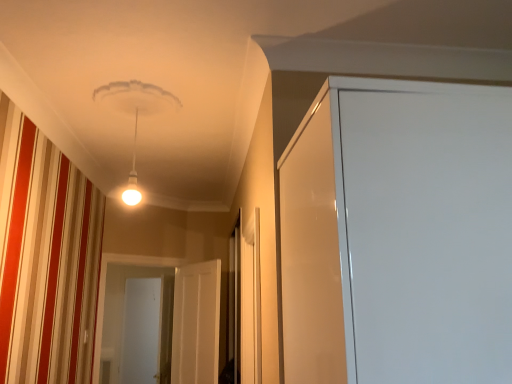
Question: Is white glossy door at center, placed as the 2th screen door when sorted from back to front, oriented towards white glossy door at center, which ranks as the 1th screen door in front-to-back order?

Choices:
 (A) no
 (B) yes

Answer: (B)

Question: Does white glossy door at center, acting as the second screen door starting from the left, contain white glossy door at center, arranged as the 3th screen door when viewed from the left?

Choices:
 (A) yes
 (B) no

Answer: (B)

Question: From the image's perspective, is white glossy door at center, which is the 2th screen door in front-to-back order, on white glossy door at center, arranged as the 3th screen door when viewed from the left?

Choices:
 (A) yes
 (B) no

Answer: (A)

Question: Is white glossy door at center, which is the 2th screen door in front-to-back order, to the right of white glossy door at center, arranged as the 3th screen door when viewed from the left, from the viewer's perspective?

Choices:
 (A) no
 (B) yes

Answer: (A)

Question: Is white glossy door at center, the 2th screen door in the right-to-left sequence, shorter than white glossy door at center, arranged as the 3th screen door when viewed from the back?

Choices:
 (A) yes
 (B) no

Answer: (B)

Question: Is white glossy door at center, placed as the 2th screen door when sorted from back to front, wider or thinner than white glossy screen door at center, arranged as the third screen door when viewed from the front?

Choices:
 (A) wide
 (B) thin

Answer: (A)

Question: Is white glossy door at center, the 2th screen door in the right-to-left sequence, bigger or smaller than white glossy screen door at center, arranged as the third screen door when viewed from the front?

Choices:
 (A) big
 (B) small

Answer: (A)

Question: From the image's perspective, relative to white glossy screen door at center, arranged as the third screen door when viewed from the front, is white glossy door at center, placed as the 2th screen door when sorted from back to front, above or below?

Choices:
 (A) above
 (B) below

Answer: (A)

Question: Is white glossy door at center, acting as the second screen door starting from the left, to the left or to the right of white glossy screen door at center, which appears as the 1th screen door when viewed from the back, in the image?

Choices:
 (A) left
 (B) right

Answer: (B)

Question: In terms of width, does white glossy screen door at center, arranged as the third screen door when viewed from the front, look wider or thinner when compared to white glossy door at center, which is the 2th screen door in front-to-back order?

Choices:
 (A) wide
 (B) thin

Answer: (B)

Question: From a real-world perspective, is white glossy screen door at center, which is counted as the first screen door, starting from the left, above or below white glossy door at center, the 2th screen door in the right-to-left sequence?

Choices:
 (A) below
 (B) above

Answer: (A)

Question: From the image's perspective, is white glossy screen door at center, which appears as the third screen door when viewed from the right, above or below white glossy door at center, acting as the second screen door starting from the left?

Choices:
 (A) below
 (B) above

Answer: (A)

Question: Considering the positions of point (143, 362) and point (98, 294), is point (143, 362) closer or farther from the camera than point (98, 294)?

Choices:
 (A) closer
 (B) farther

Answer: (B)

Question: In terms of width, does white glossy door at center, the 2th screen door in the right-to-left sequence, look wider or thinner when compared to white glossy door at center, arranged as the 3th screen door when viewed from the left?

Choices:
 (A) wide
 (B) thin

Answer: (A)

Question: Considering the positions of white glossy door at center, acting as the second screen door starting from the left, and white glossy door at center, which is the 1th screen door from right to left, in the image, is white glossy door at center, acting as the second screen door starting from the left, taller or shorter than white glossy door at center, which is the 1th screen door from right to left,?

Choices:
 (A) short
 (B) tall

Answer: (B)